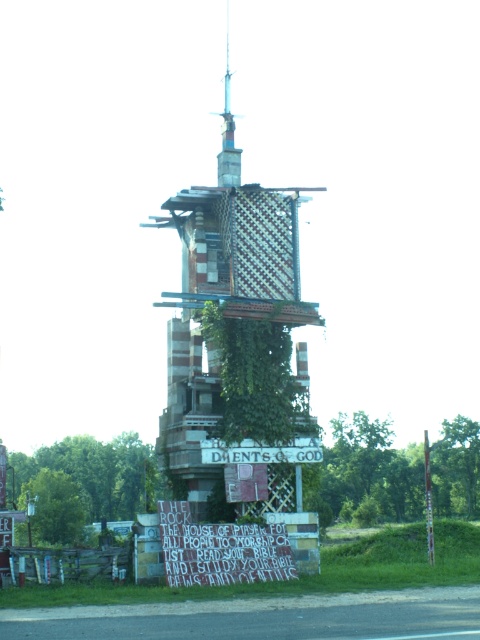
You are standing in front of the collapsed tower and notice two points marked on its facade. The first point is at coordinates point (159,305) and the second is at point (265,397). Which point is closer to you?

Point (159,305) is closer to the viewer than point (265,397).

You are standing in front of the partially collapsed tower and notice the green leafy ivy at center and the white wooden sign at center. Which object is taller?

The white wooden sign at center is taller than the green leafy ivy at center.

What is the spatial relationship between the white wooden sign at center and the green wood pole at right in the image?

The white wooden sign at center is to the left of the green wood pole at right.